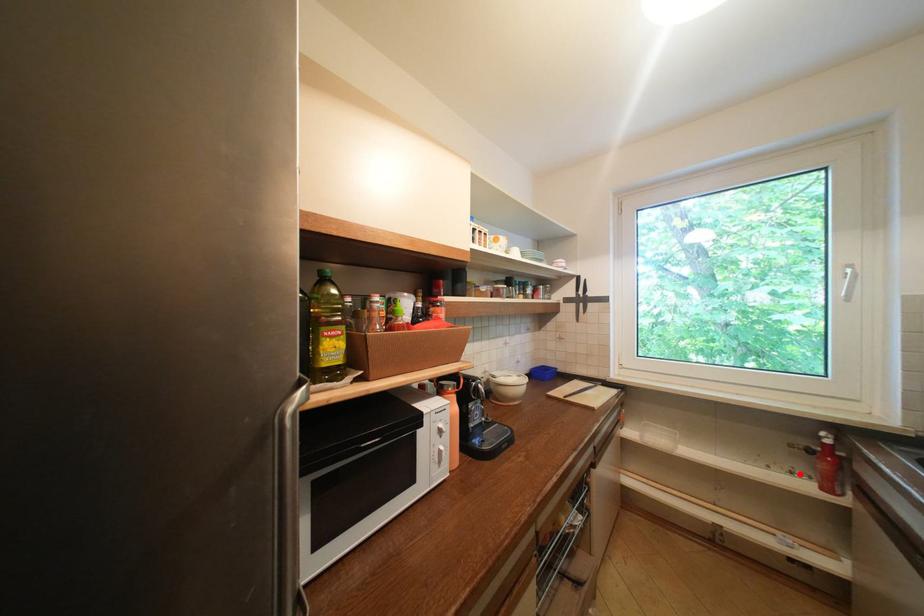
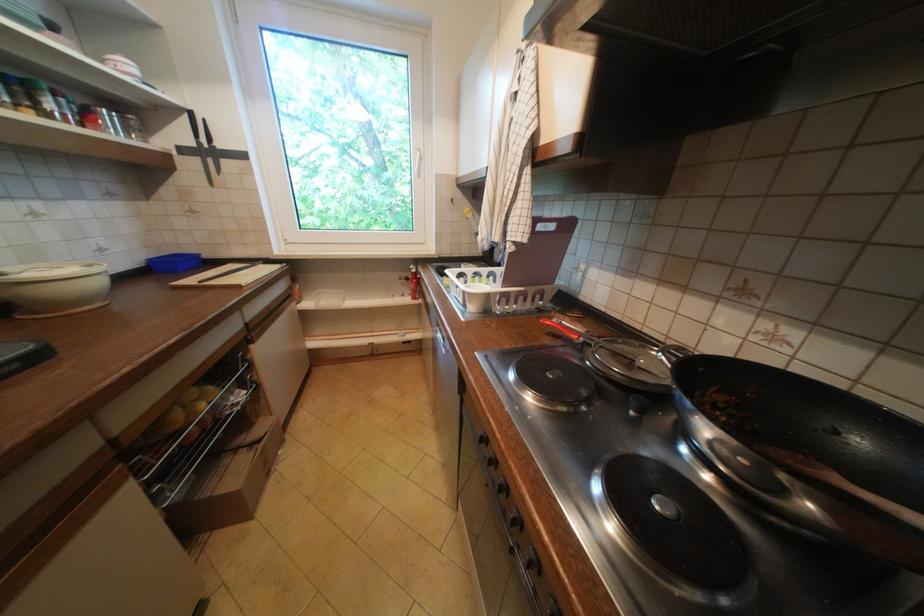
Locate, in the second image, the point that corresponds to the highlighted location in the first image.

(410, 296)